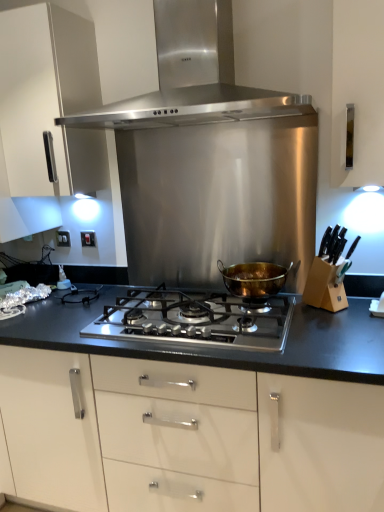
Question: Which is correct: gold metallic pot at center, the first kitchen appliance when ordered from bottom to top, is inside stainless steel gas stove at center, or outside of it?

Choices:
 (A) outside
 (B) inside

Answer: (A)

Question: Considering the positions of gold metallic pot at center, the second kitchen appliance positioned from the top, and stainless steel gas stove at center in the image, is gold metallic pot at center, the second kitchen appliance positioned from the top, bigger or smaller than stainless steel gas stove at center?

Choices:
 (A) small
 (B) big

Answer: (A)

Question: Which object is the farthest from the stainless steel gas stove at center?

Choices:
 (A) gold metallic pot at center, the second kitchen appliance positioned from the top
 (B) white plastic electric outlet at left, arranged as the 2th electric outlet when viewed from the back
 (C) white plastic electric outlet at left, which ranks as the 1th electric outlet in back-to-front order
 (D) white glossy cabinet at upper left
 (E) stainless steel range hood at upper center, which is counted as the 1th kitchen appliance, starting from the top

Answer: (C)

Question: Considering the real-world distances, which object is closest to the stainless steel gas stove at center?

Choices:
 (A) white glossy cabinet at upper left
 (B) white plastic electric outlet at left, which is counted as the second electric outlet, starting from the right
 (C) gold metallic pot at center, the second kitchen appliance positioned from the top
 (D) white plastic electric outlet at left, arranged as the second electric outlet when viewed from the left
 (E) stainless steel range hood at upper center, which is counted as the 1th kitchen appliance, starting from the top

Answer: (C)